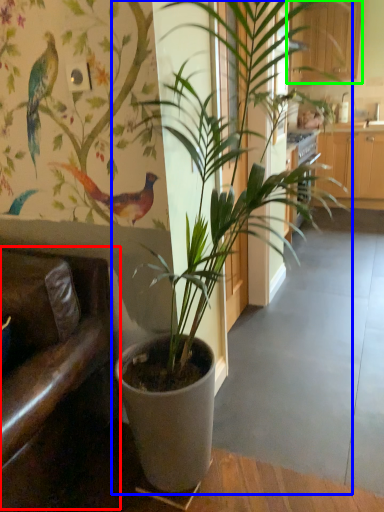
Question: Which object is positioned closest to armchair (highlighted by a red box)? Select from houseplant (highlighted by a blue box) and furniture (highlighted by a green box).

Choices:
 (A) houseplant
 (B) furniture

Answer: (A)